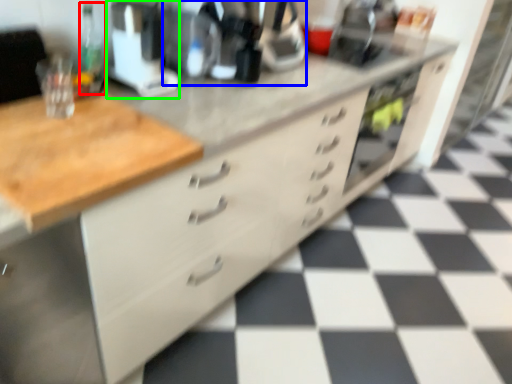
Question: Based on their relative distances, which object is farther from bottle (highlighted by a red box)? Choose from coffee machine (highlighted by a blue box) and appliance (highlighted by a green box).

Choices:
 (A) coffee machine
 (B) appliance

Answer: (A)